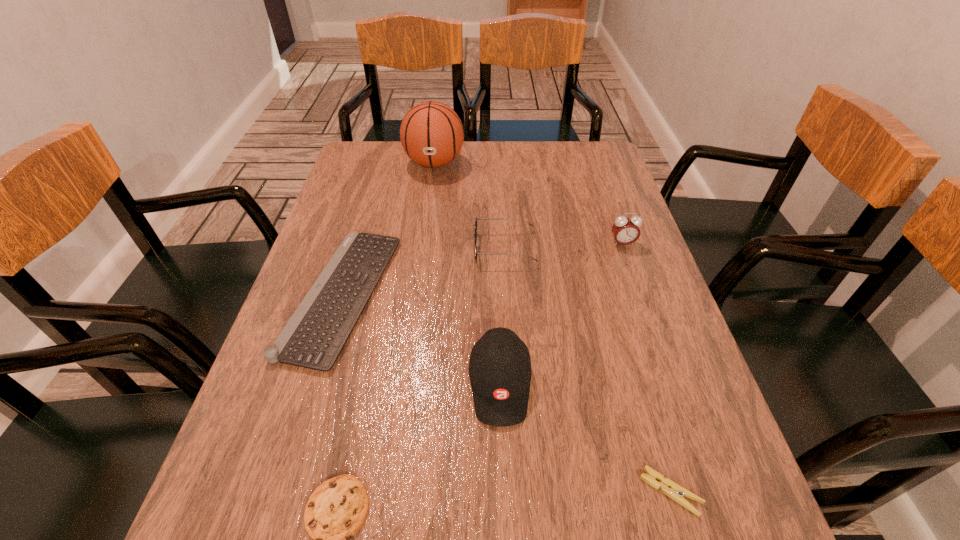
At what (x,y) coordinates should I click in order to perform the action: click on blank space at the left edge. Please return your answer as a coordinate pair (x, y). Image resolution: width=960 pixels, height=540 pixels. Looking at the image, I should click on (300, 296).

Locate an element on the screen. The image size is (960, 540). vacant space at the right edge of the desktop is located at coordinates (624, 374).

The width and height of the screenshot is (960, 540). Find the location of `vacant space at the far left corner`. vacant space at the far left corner is located at coordinates (397, 164).

In order to click on free location at the far right corner of the desktop in this screenshot , I will do `click(584, 157)`.

Locate an element on the screen. This screenshot has height=540, width=960. vacant area between the baseball cap and the basketball is located at coordinates (468, 274).

Identify the location of vacant space that is in between the spectacles and the farthest object. (469, 206).

Where is `free space between the clothespin and the fourth shortest object`? Image resolution: width=960 pixels, height=540 pixels. free space between the clothespin and the fourth shortest object is located at coordinates (588, 369).

At what (x,y) coordinates should I click in order to perform the action: click on blank region between the baseball cap and the spectacles. Please return your answer as a coordinate pair (x, y). Image resolution: width=960 pixels, height=540 pixels. Looking at the image, I should click on (502, 316).

Find the location of a particular element. This screenshot has width=960, height=540. blank region between the alarm clock and the farthest object is located at coordinates (528, 204).

Identify which object is located as the nearest to the fourth tallest object. Please provide its 2D coordinates. Your answer should be formatted as a tuple, i.e. [(x, y)], where the tuple contains the x and y coordinates of a point satisfying the conditions above.

[(314, 336)]